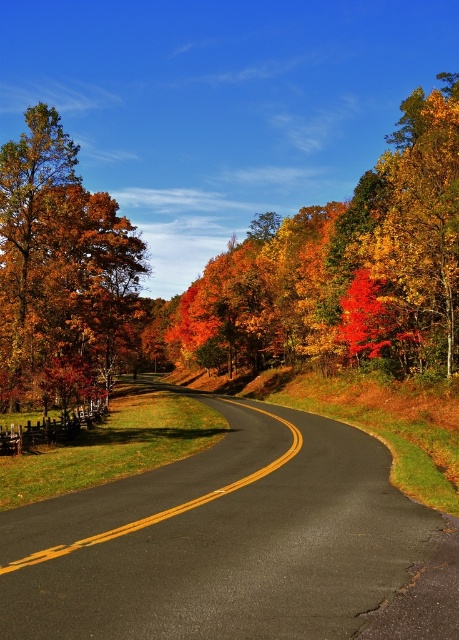
Question: Is orange autumn leaves at left smaller than bright red leaves at center?

Choices:
 (A) no
 (B) yes

Answer: (A)

Question: Which point appears farthest from the camera in this image?

Choices:
 (A) pos(21,278)
 (B) pos(358,296)

Answer: (A)

Question: Does orange autumn leaves at left have a smaller size compared to bright red leaves at center?

Choices:
 (A) no
 (B) yes

Answer: (A)

Question: Among these points, which one is nearest to the camera?

Choices:
 (A) (350, 289)
 (B) (57, 208)

Answer: (A)

Question: Is orange autumn leaves at left smaller than bright red leaves at center?

Choices:
 (A) yes
 (B) no

Answer: (B)

Question: Which point appears farthest from the camera in this image?

Choices:
 (A) (73, 256)
 (B) (343, 314)

Answer: (A)